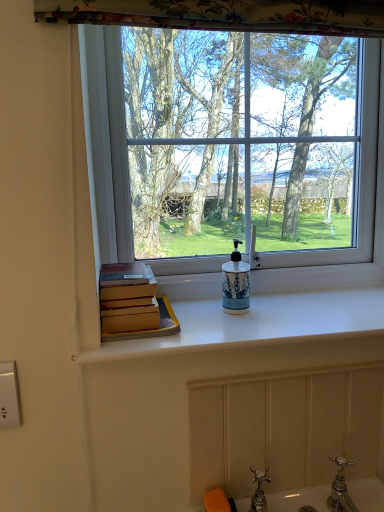
Question: Is blue and white ceramic soap dispenser at center oriented away from white glossy counter top at center?

Choices:
 (A) no
 (B) yes

Answer: (A)

Question: Is the position of blue and white ceramic soap dispenser at center more distant than that of white glossy counter top at center?

Choices:
 (A) yes
 (B) no

Answer: (A)

Question: Does blue and white ceramic soap dispenser at center lie in front of white glossy counter top at center?

Choices:
 (A) yes
 (B) no

Answer: (B)

Question: Does blue and white ceramic soap dispenser at center have a lesser width compared to white glossy counter top at center?

Choices:
 (A) no
 (B) yes

Answer: (B)

Question: Considering the relative sizes of blue and white ceramic soap dispenser at center and white glossy counter top at center in the image provided, is blue and white ceramic soap dispenser at center shorter than white glossy counter top at center?

Choices:
 (A) yes
 (B) no

Answer: (B)

Question: Is hardcover books at left spatially inside white glossy counter top at center, or outside of it?

Choices:
 (A) outside
 (B) inside

Answer: (A)

Question: Does point (109, 336) appear closer or farther from the camera than point (263, 303)?

Choices:
 (A) farther
 (B) closer

Answer: (B)

Question: Is hardcover books at left bigger or smaller than white glossy counter top at center?

Choices:
 (A) small
 (B) big

Answer: (A)

Question: Would you say hardcover books at left is to the left or to the right of white glossy counter top at center in the picture?

Choices:
 (A) left
 (B) right

Answer: (A)

Question: In the image, is white plastic electric outlet at lower left positioned in front of or behind hardcover books at left?

Choices:
 (A) behind
 (B) front

Answer: (B)

Question: Does point (6, 378) appear closer or farther from the camera than point (142, 264)?

Choices:
 (A) closer
 (B) farther

Answer: (A)

Question: Which is correct: white plastic electric outlet at lower left is inside hardcover books at left, or outside of it?

Choices:
 (A) outside
 (B) inside

Answer: (A)

Question: Considering the positions of white plastic electric outlet at lower left and hardcover books at left in the image, is white plastic electric outlet at lower left taller or shorter than hardcover books at left?

Choices:
 (A) tall
 (B) short

Answer: (A)

Question: In terms of width, does transparent glass window at center look wider or thinner when compared to hardcover books at left?

Choices:
 (A) wide
 (B) thin

Answer: (B)

Question: From the image's perspective, is transparent glass window at center positioned above or below hardcover books at left?

Choices:
 (A) below
 (B) above

Answer: (B)